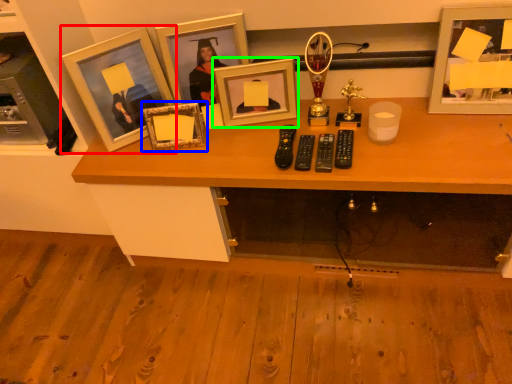
Question: Which object is positioned closest to picture frame (highlighted by a red box)? Select from picture frame (highlighted by a blue box) and picture frame (highlighted by a green box).

Choices:
 (A) picture frame
 (B) picture frame

Answer: (A)